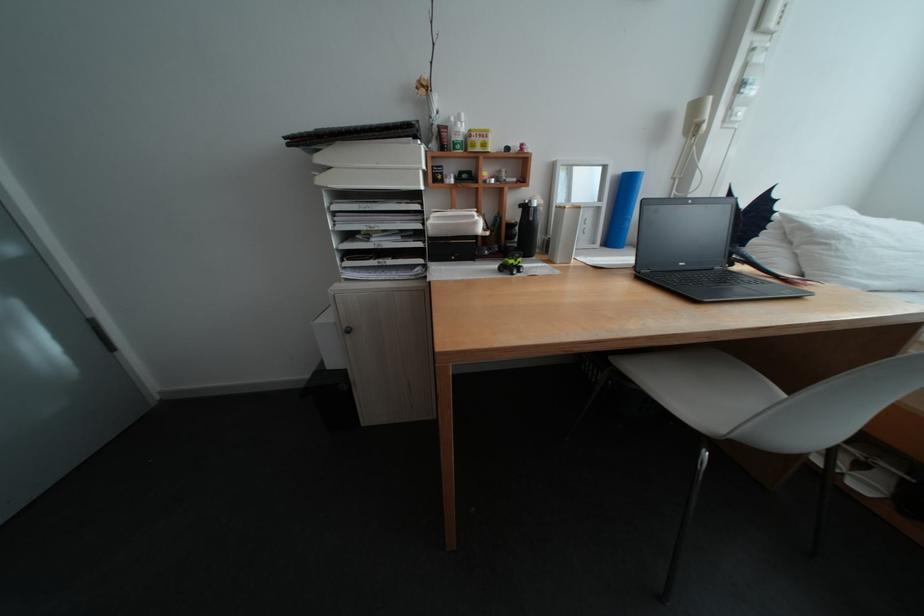
The height and width of the screenshot is (616, 924). What do you see at coordinates (371, 155) in the screenshot? I see `a white paper tray` at bounding box center [371, 155].